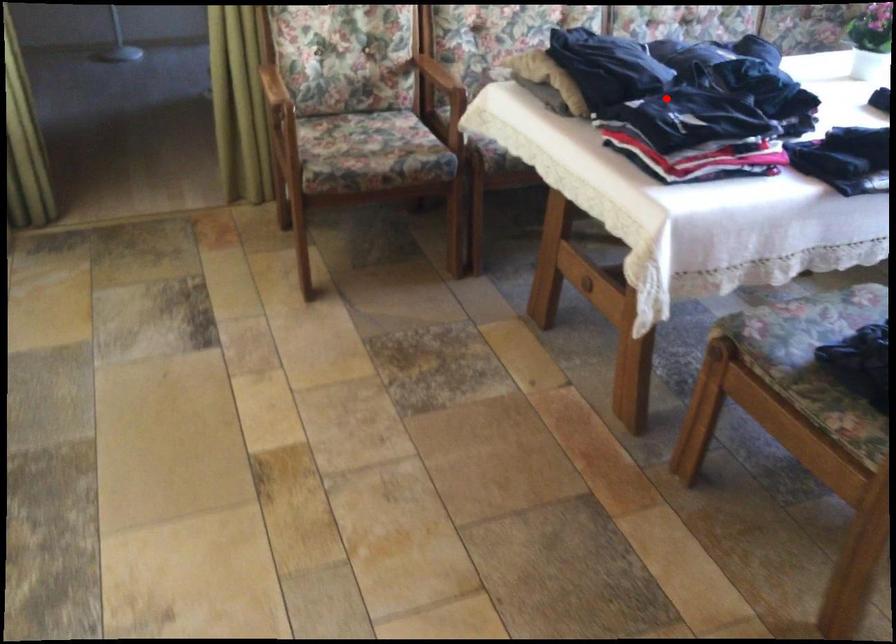
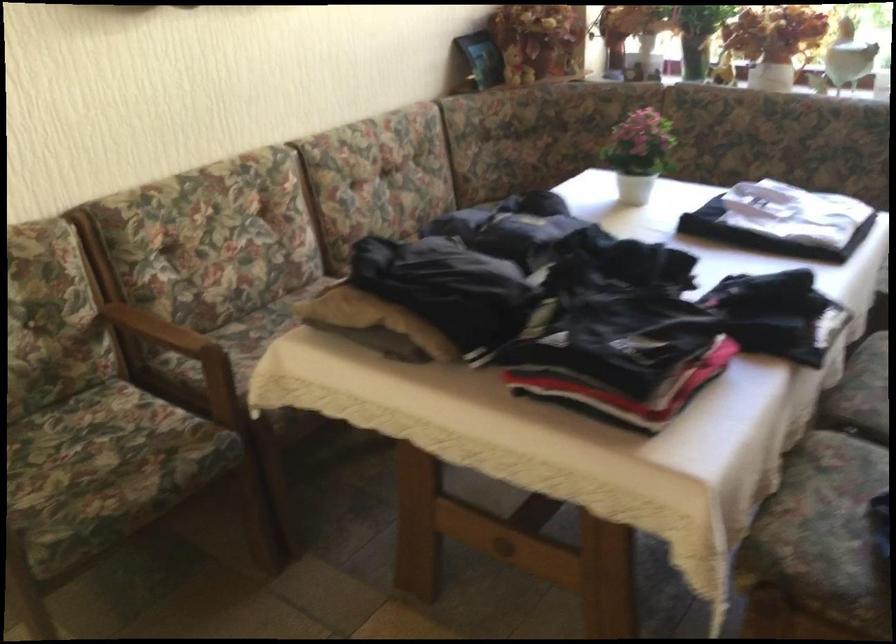
Question: I am providing you with two images of the same scene from different viewpoints. A red point is shown in image1. For the corresponding object point in image2, is it positioned nearer or farther from the camera?

Choices:
 (A) Nearer
 (B) Farther

Answer: (A)